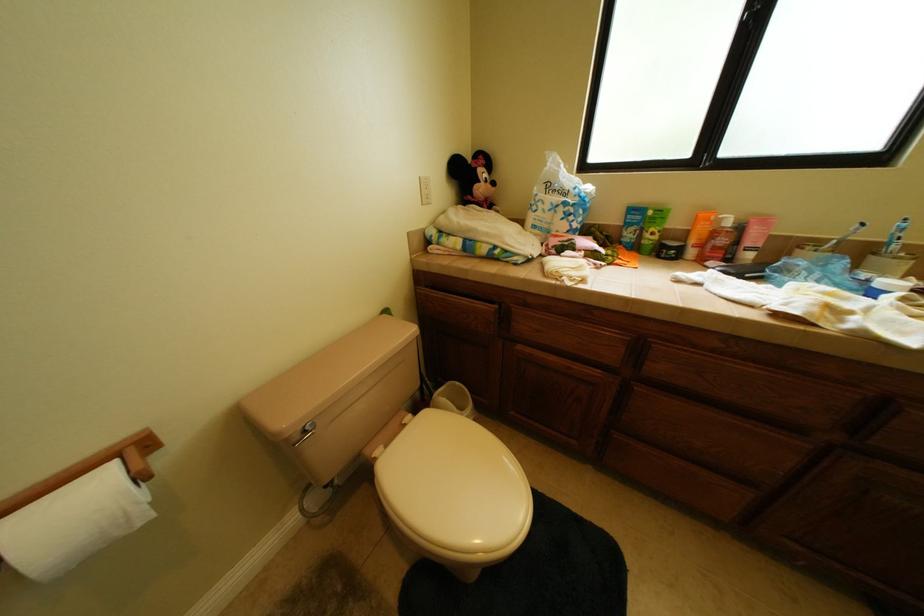
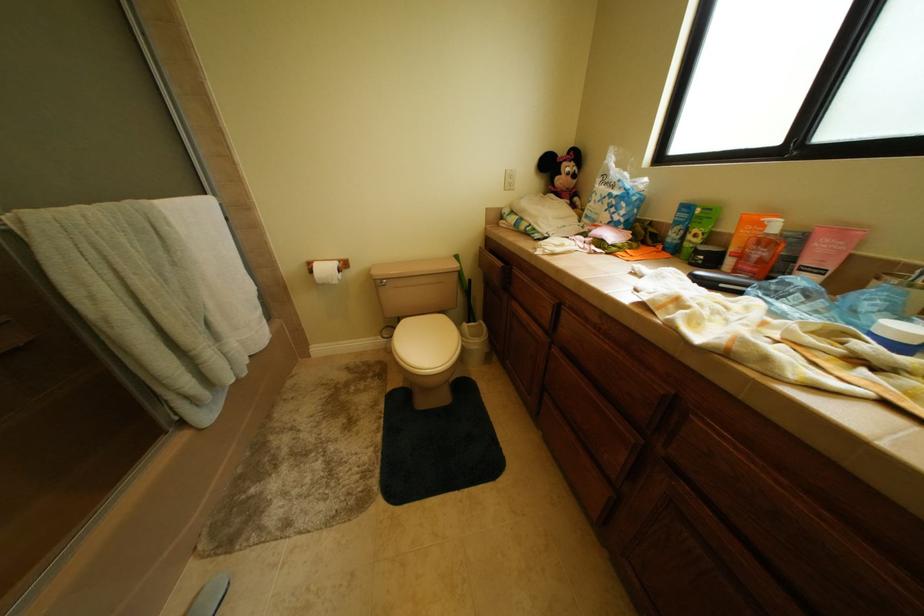
Question: The first image is from the beginning of the video and the second image is from the end. How did the camera likely rotate when shooting the video?

Choices:
 (A) Left
 (B) Right
 (C) Up
 (D) Down

Answer: (A)